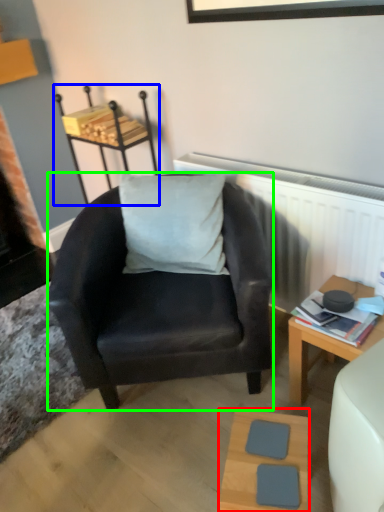
Question: Which object is positioned farthest from table (highlighted by a red box)? Select from stool (highlighted by a blue box) and chair (highlighted by a green box).

Choices:
 (A) stool
 (B) chair

Answer: (A)